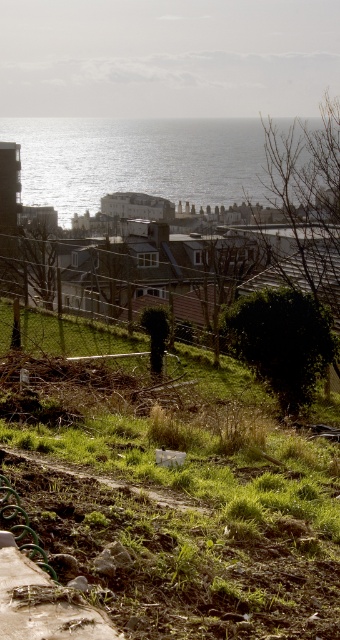
Question: Which point appears closest to the camera in this image?

Choices:
 (A) (93, 288)
 (B) (24, 502)
 (C) (180, 502)

Answer: (B)

Question: Estimate the real-world distances between objects in this image. Which object is closer to the green grass at lower center?

Choices:
 (A) glistening silver water at upper center
 (B) brown wire fence at center

Answer: (B)

Question: Among these objects, which one is nearest to the camera?

Choices:
 (A) glistening silver water at upper center
 (B) green grass at lower center

Answer: (B)

Question: Is glistening silver water at upper center behind green grassy path at lower center?

Choices:
 (A) yes
 (B) no

Answer: (A)

Question: Is the position of green grass at lower center less distant than that of green grassy path at lower center?

Choices:
 (A) no
 (B) yes

Answer: (B)

Question: Is brown wire fence at center positioned at the back of green grassy path at lower center?

Choices:
 (A) yes
 (B) no

Answer: (A)